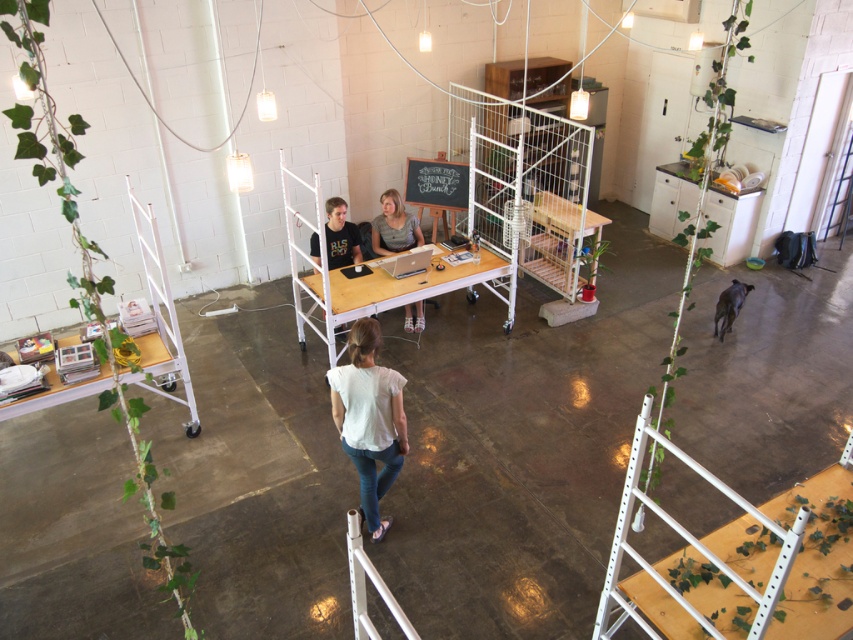
Question: From the image, what is the correct spatial relationship of wooden table at lower left in relation to matte black laptop at center?

Choices:
 (A) right
 (B) left

Answer: (B)

Question: Which object is positioned farthest from the wooden table at lower left?

Choices:
 (A) wooden table at center
 (B) white cotton shirt at center

Answer: (B)

Question: Can you confirm if white wire mesh cage at upper center is smaller than chalkboard at center?

Choices:
 (A) yes
 (B) no

Answer: (B)

Question: Estimate the real-world distances between objects in this image. Which object is farther from the wooden table at center?

Choices:
 (A) chalkboard at center
 (B) wooden table at lower left
 (C) white cotton shirt at center
 (D) white wire mesh cage at upper center

Answer: (D)

Question: Among these points, which one is farthest from the camera?

Choices:
 (A) (467, 196)
 (B) (416, 284)
 (C) (543, 241)
 (D) (412, 218)

Answer: (C)

Question: Does chalkboard at center appear on the right side of matte black laptop at center?

Choices:
 (A) yes
 (B) no

Answer: (A)